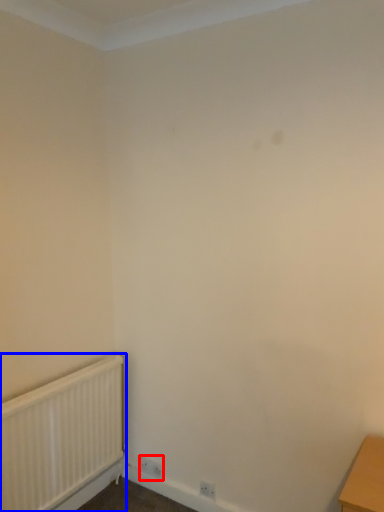
Question: Among these objects, which one is farthest to the camera, electric outlet (highlighted by a red box) or radiator (highlighted by a blue box)?

Choices:
 (A) electric outlet
 (B) radiator

Answer: (A)